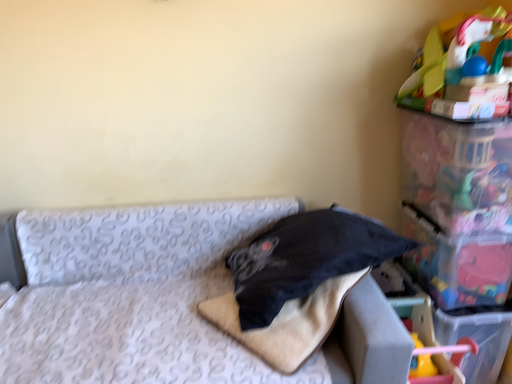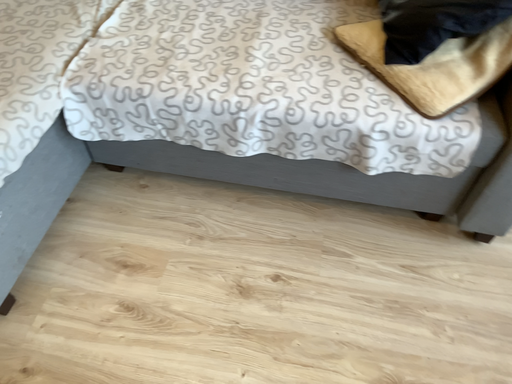
Question: Which way did the camera rotate in the video?

Choices:
 (A) rotated upward
 (B) rotated downward

Answer: (B)